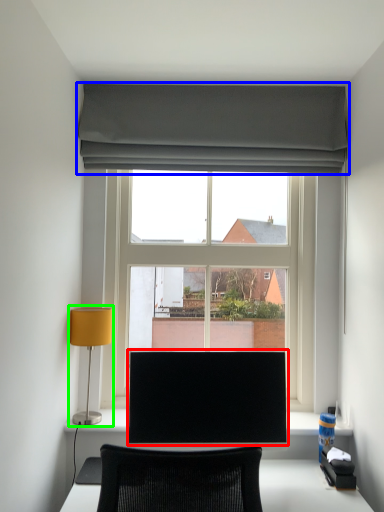
Question: Based on their relative distances, which object is nearer to computer monitor (highlighted by a red box)? Choose from curtain (highlighted by a blue box) and table lamp (highlighted by a green box).

Choices:
 (A) curtain
 (B) table lamp

Answer: (B)